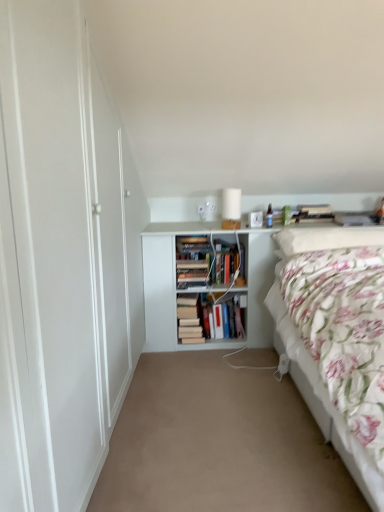
Question: Is white glossy table lamp at center thinner than hardcover books at center, the first book viewed from the left?

Choices:
 (A) yes
 (B) no

Answer: (A)

Question: Is white glossy table lamp at center smaller than hardcover books at center, the first book viewed from the left?

Choices:
 (A) yes
 (B) no

Answer: (A)

Question: Is white glossy table lamp at center completely or partially outside of hardcover books at center, the 2th book viewed from the right?

Choices:
 (A) no
 (B) yes

Answer: (B)

Question: Is white glossy table lamp at center directly adjacent to hardcover books at center, the first book viewed from the left?

Choices:
 (A) no
 (B) yes

Answer: (A)

Question: Is white glossy table lamp at center bigger than hardcover books at center, the 2th book viewed from the right?

Choices:
 (A) no
 (B) yes

Answer: (A)

Question: From the image's perspective, does white glossy table lamp at center appear lower than hardcover books at center, the 2th book viewed from the right?

Choices:
 (A) no
 (B) yes

Answer: (A)

Question: Can you confirm if white matte bookshelf at center is positioned to the right of hardcover books at center, the 2th book viewed from the right?

Choices:
 (A) yes
 (B) no

Answer: (A)

Question: Is white matte bookshelf at center aimed at hardcover books at center, the first book viewed from the left?

Choices:
 (A) yes
 (B) no

Answer: (A)

Question: Is white matte bookshelf at center to the left of hardcover books at center, the 2th book viewed from the right, from the viewer's perspective?

Choices:
 (A) yes
 (B) no

Answer: (B)

Question: Can hardcover books at center, the first book viewed from the left, be found inside white matte bookshelf at center?

Choices:
 (A) no
 (B) yes

Answer: (B)

Question: Is the depth of white matte bookshelf at center less than that of hardcover books at center, the first book viewed from the left?

Choices:
 (A) no
 (B) yes

Answer: (B)

Question: Is white matte bookshelf at center placed right next to hardcover books at center, the 2th book viewed from the right?

Choices:
 (A) yes
 (B) no

Answer: (B)

Question: Considering the relative sizes of fluffy white pillow at upper right and beige carpet at center in the image provided, is fluffy white pillow at upper right shorter than beige carpet at center?

Choices:
 (A) yes
 (B) no

Answer: (B)